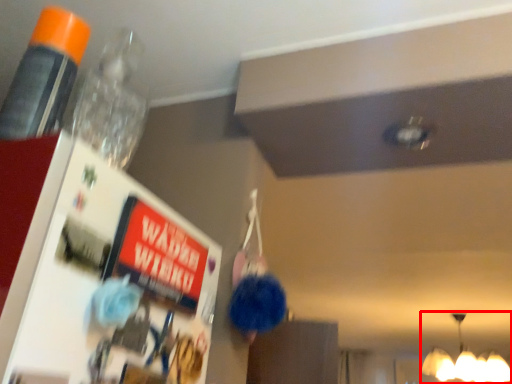
Question: In this image, where is lamp (annotated by the red box) located relative to bottle?

Choices:
 (A) left
 (B) right

Answer: (B)